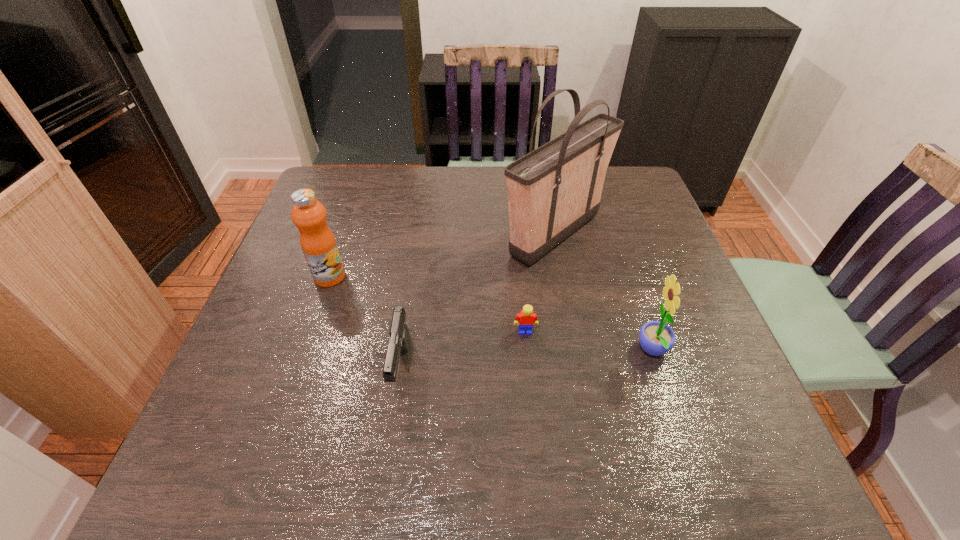
What are the coordinates of `vacant space at the left edge` in the screenshot? It's located at (345, 225).

Where is `vacant space at the right edge of the desktop`? The height and width of the screenshot is (540, 960). vacant space at the right edge of the desktop is located at coordinates (675, 341).

Locate an element on the screen. vacant space at the near left corner of the desktop is located at coordinates (181, 487).

Locate an element on the screen. free space between the fruit juice and the shortest object is located at coordinates (427, 304).

The width and height of the screenshot is (960, 540). Identify the location of empty space between the second shortest object and the shopping bag. (478, 302).

Where is `vacant area that lies between the shortest object and the leftmost object`? The image size is (960, 540). vacant area that lies between the shortest object and the leftmost object is located at coordinates (427, 304).

Identify the location of vacant area between the fruit juice and the sunflower. (492, 314).

Locate an element on the screen. This screenshot has width=960, height=540. free spot between the Lego and the sunflower is located at coordinates (589, 341).

The height and width of the screenshot is (540, 960). I want to click on empty space between the shortest object and the shopping bag, so click(x=540, y=284).

Where is `free space between the leftmost object and the tallest object`? free space between the leftmost object and the tallest object is located at coordinates (443, 256).